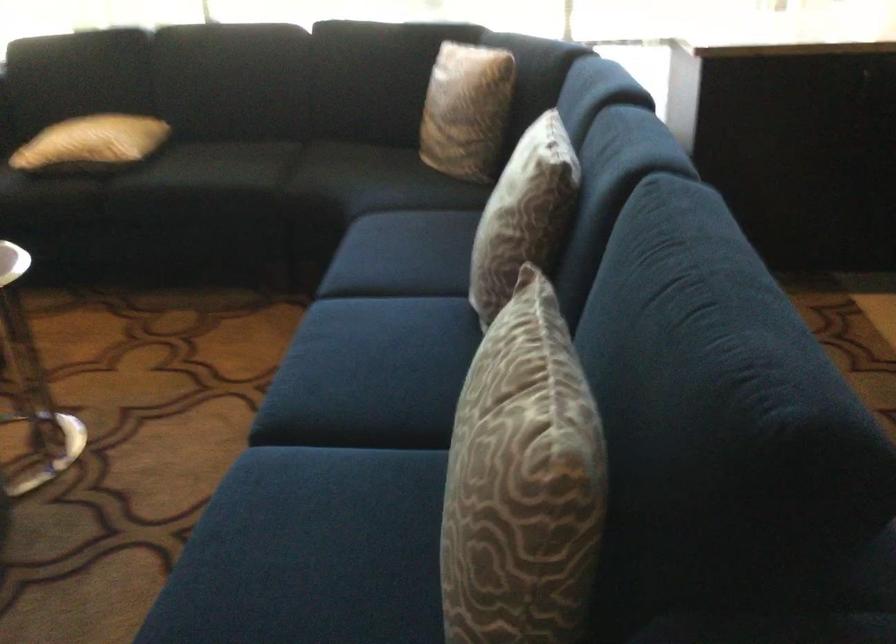
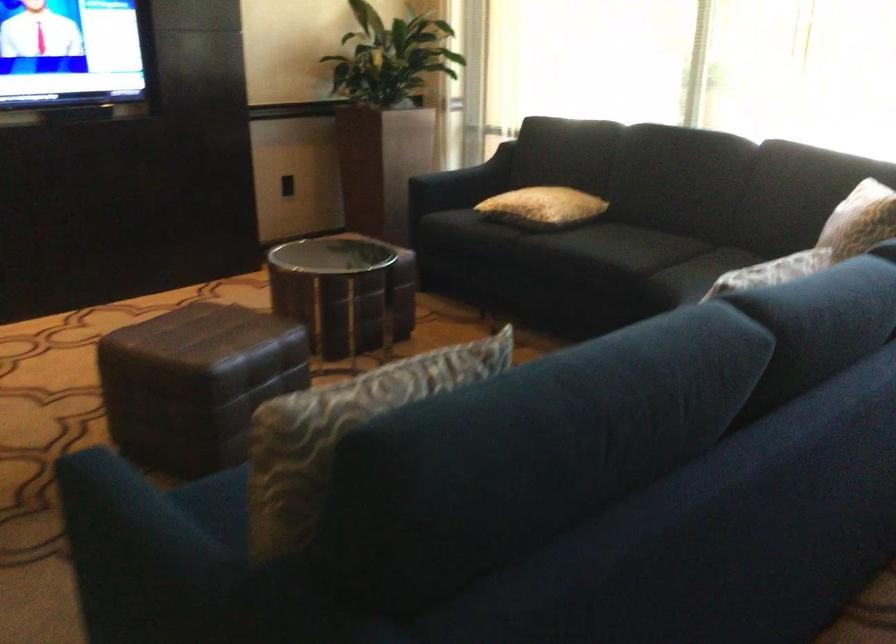
Question: I am providing you with two images of the same scene from different viewpoints. Please identify which objects are invisible in image2.

Choices:
 (A) black seatbelt buckle
 (B) patterned throw pillow
 (C) sofa armrest
 (D) patterned cushion

Answer: (B)